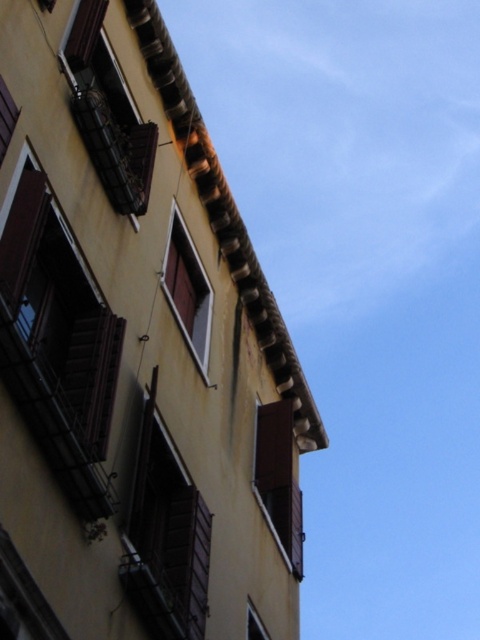
You are an architect assessing the building facade. You need to install a new air conditioner unit that requires a minimum of 1 meter width on the window. Which window between the brown wooden window at left and the brown wooden window at center should you choose?

The brown wooden window at center should be chosen because its width is greater than the brown wooden window at left, meeting the minimum 1 meter requirement for installing the air conditioner unit.

You are standing in front of the building and want to touch the brown wooden window at left and the matte brown window at lower center. Which one would you reach first without moving your feet?

The brown wooden window at left is closer to the viewer than the matte brown window at lower center, so you would reach the brown wooden window at left first.

You are an architect assessing the building facade. You need to install a new air conditioning unit that requires a minimum of 1.5 meters of space. Which window, the brown matte window at center or the matte brown window at lower center, is more suitable for this installation based on their sizes?

The brown matte window at center has a larger size compared to the matte brown window at lower center, so it is more suitable for installing the air conditioning unit requiring 1.5 meters of space.